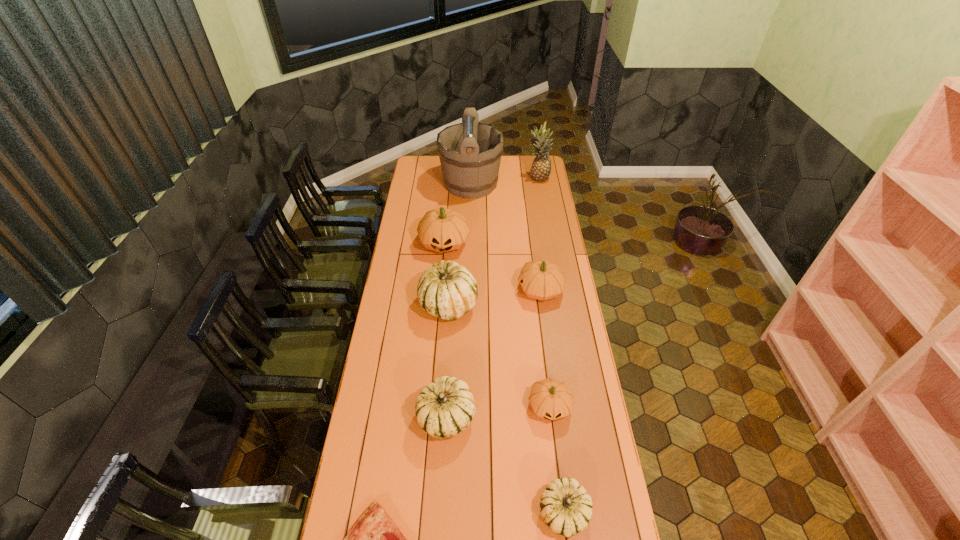
Locate an element on the screen. Image resolution: width=960 pixels, height=540 pixels. vacant area that lies between the second biggest orange gourd and the biggest white gourd is located at coordinates (494, 297).

Locate an element on the screen. object that can be found as the sixth closest to the smallest orange gourd is located at coordinates (443, 229).

Choose which object is the nearest neighbor to the smallest white gourd. Please provide its 2D coordinates. Your answer should be formatted as a tuple, i.e. [(x, y)], where the tuple contains the x and y coordinates of a point satisfying the conditions above.

[(550, 399)]

Identify which gourd is the second nearest to the farthest white gourd. Please provide its 2D coordinates. Your answer should be formatted as a tuple, i.e. [(x, y)], where the tuple contains the x and y coordinates of a point satisfying the conditions above.

[(540, 279)]

Select which gourd appears as the second closest to the rightmost white gourd. Please provide its 2D coordinates. Your answer should be formatted as a tuple, i.e. [(x, y)], where the tuple contains the x and y coordinates of a point satisfying the conditions above.

[(444, 408)]

Select which orange gourd appears as the closest to the smallest orange gourd. Please provide its 2D coordinates. Your answer should be formatted as a tuple, i.e. [(x, y)], where the tuple contains the x and y coordinates of a point satisfying the conditions above.

[(540, 279)]

Image resolution: width=960 pixels, height=540 pixels. I want to click on the closest orange gourd to the nearest orange gourd, so click(x=540, y=279).

Select which white gourd is the closest to the bucket. Please provide its 2D coordinates. Your answer should be formatted as a tuple, i.e. [(x, y)], where the tuple contains the x and y coordinates of a point satisfying the conditions above.

[(447, 290)]

This screenshot has width=960, height=540. What are the coordinates of `the closest white gourd to the biggest white gourd` in the screenshot? It's located at (444, 408).

Locate an element on the screen. vacant space that satisfies the following two spatial constraints: 1. on the side of the second smallest white gourd with the carved face; 2. on the right side of the farthest gourd is located at coordinates (429, 416).